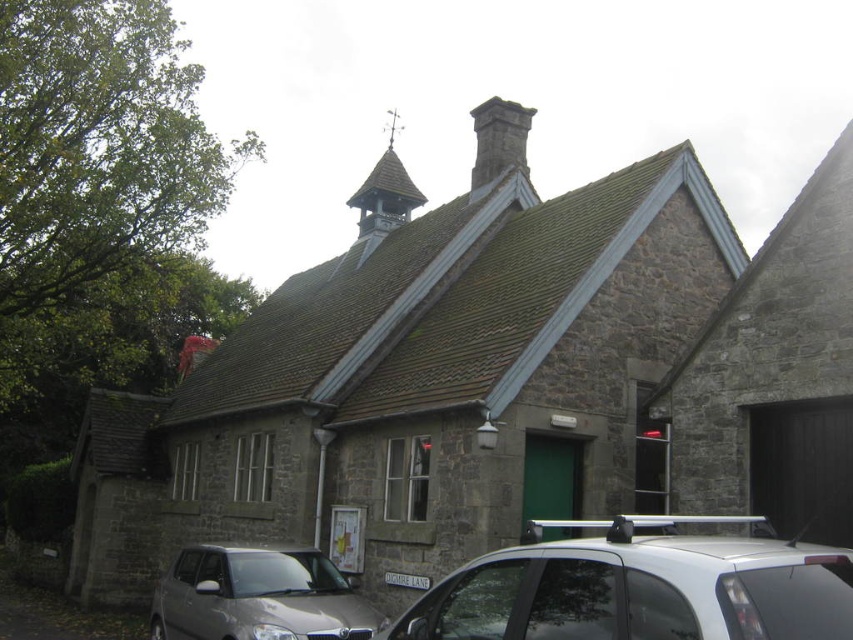
Between point (807, 593) and point (247, 605), which one is positioned behind?

Positioned behind is point (247, 605).

Which is more to the right, silver metallic car at lower right or satin silver car at lower left?

From the viewer's perspective, silver metallic car at lower right appears more on the right side.

You are a GUI agent. You are given a task and a screenshot of the screen. Output one action in this format:
    pyautogui.click(x=<x>, y=<y>)
    Task: Click on the silver metallic car at lower right
    This screenshot has width=853, height=640.
    Given the screenshot: What is the action you would take?
    pyautogui.click(x=640, y=586)

Is point (434, 636) positioned after point (396, 125)?

That is False.

Is point (718, 605) closer to viewer compared to point (370, 216)?

That is True.

Between point (598, 608) and point (381, 209), which one is positioned behind?

Point (381, 209)

Find the location of a particular element. This screenshot has width=853, height=640. silver metallic car at lower right is located at coordinates (640, 586).

Between satin silver car at lower left and dark gray stone chimney at upper center, which one is positioned higher?

dark gray stone chimney at upper center

Does satin silver car at lower left appear under dark gray stone chimney at upper center?

Yes, satin silver car at lower left is below dark gray stone chimney at upper center.

Image resolution: width=853 pixels, height=640 pixels. What are the coordinates of `satin silver car at lower left` in the screenshot? It's located at (257, 596).

Image resolution: width=853 pixels, height=640 pixels. In order to click on satin silver car at lower left in this screenshot , I will do `click(257, 596)`.